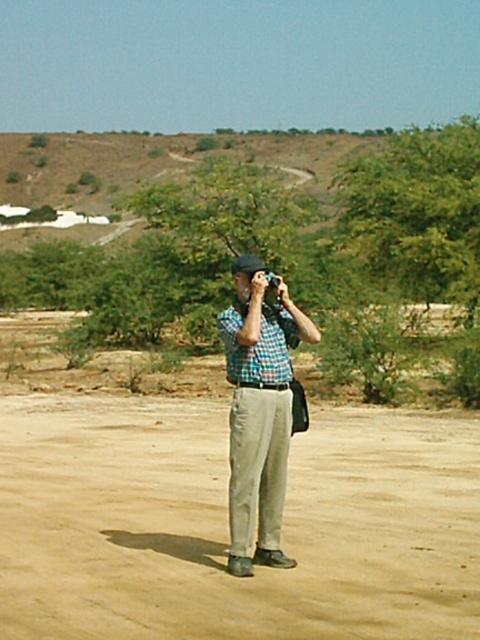
Which is more to the left, tan sandy ground at center or checkered fabric shirt at center?

checkered fabric shirt at center is more to the left.

Is tan sandy ground at center to the left of checkered fabric shirt at center from the viewer's perspective?

In fact, tan sandy ground at center is to the right of checkered fabric shirt at center.

Is point (66, 593) positioned behind point (279, 493)?

That is False.

At what (x,y) coordinates should I click in order to perform the action: click on tan sandy ground at center. Please return your answer as a coordinate pair (x, y). The width and height of the screenshot is (480, 640). Looking at the image, I should click on (227, 524).